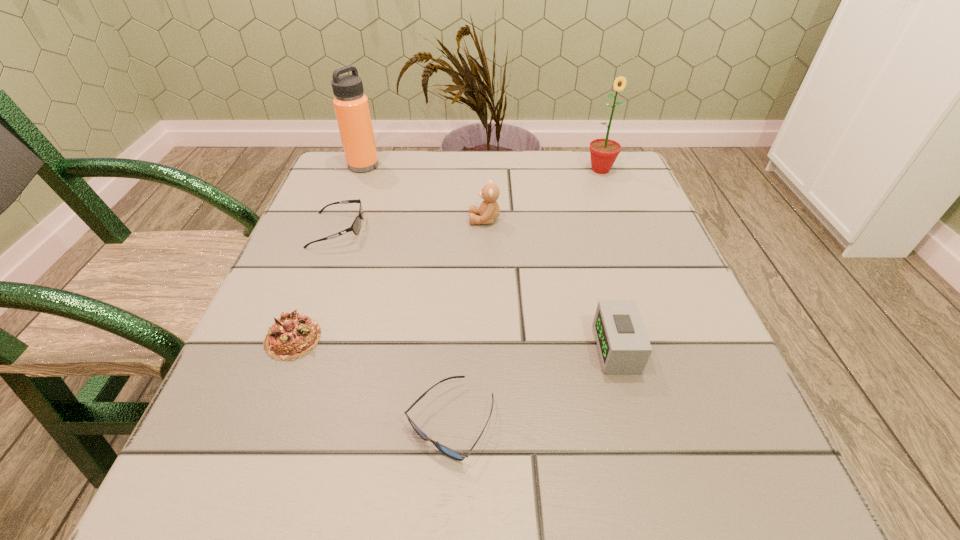
Where is `free space between the farther sunglasses and the right sunglasses`? free space between the farther sunglasses and the right sunglasses is located at coordinates (394, 326).

You are a GUI agent. You are given a task and a screenshot of the screen. Output one action in this format:
    pyautogui.click(x=<x>, y=<y>)
    Task: Click on the free space between the rightmost object and the nearest object
    This screenshot has height=540, width=960.
    Given the screenshot: What is the action you would take?
    pyautogui.click(x=525, y=295)

Find the location of a particular element. free spot between the thermos bottle and the shorter sunglasses is located at coordinates (407, 294).

The image size is (960, 540). Find the location of `vacant area that lies between the nearer sunglasses and the thermos bottle`. vacant area that lies between the nearer sunglasses and the thermos bottle is located at coordinates (407, 294).

Locate an element on the screen. This screenshot has height=540, width=960. free space between the fifth shortest object and the thermos bottle is located at coordinates (424, 193).

At what (x,y) coordinates should I click in order to perform the action: click on free space between the fourth tallest object and the teddy bear. Please return your answer as a coordinate pair (x, y). Looking at the image, I should click on (551, 284).

I want to click on object that stands as the fifth closest to the thermos bottle, so click(456, 455).

Point out which object is positioned as the second nearest to the teddy bear. Please provide its 2D coordinates. Your answer should be formatted as a tuple, i.e. [(x, y)], where the tuple contains the x and y coordinates of a point satisfying the conditions above.

[(603, 152)]

Image resolution: width=960 pixels, height=540 pixels. Identify the location of blank area in the image that satisfies the following two spatial constraints: 1. on the front-facing side of the teddy bear; 2. at the front of the nearest object showing the lenses. (488, 422).

The width and height of the screenshot is (960, 540). I want to click on free spot that satisfies the following two spatial constraints: 1. on the face of the sunflower; 2. on the front-facing side of the farther sunglasses, so click(623, 230).